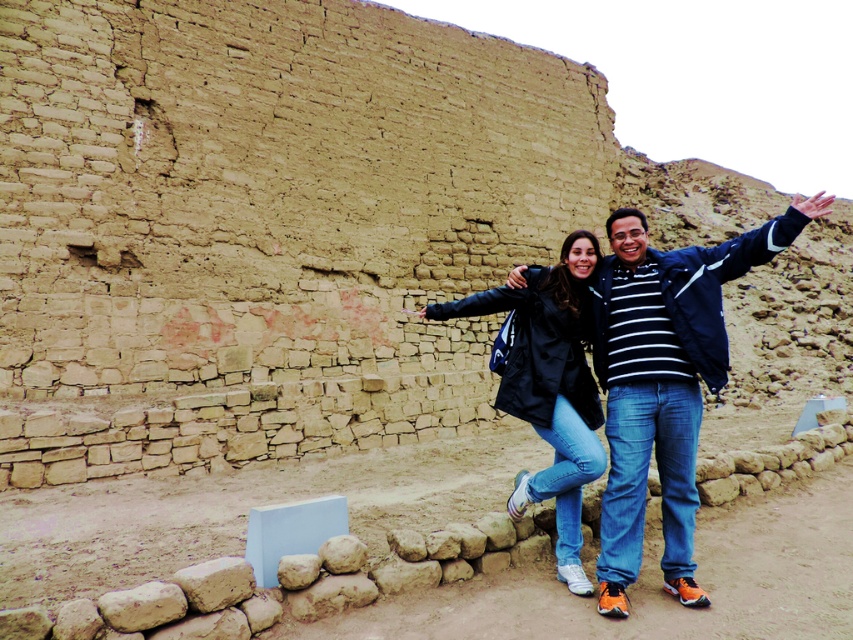
Is point (616, 602) less distant than point (560, 477)?

Yes.

Is matte black jacket at center thinner than black matte jacket at center?

No.

Is point (631, 429) positioned before point (567, 404)?

Yes.

The image size is (853, 640). I want to click on matte black jacket at center, so click(x=664, y=380).